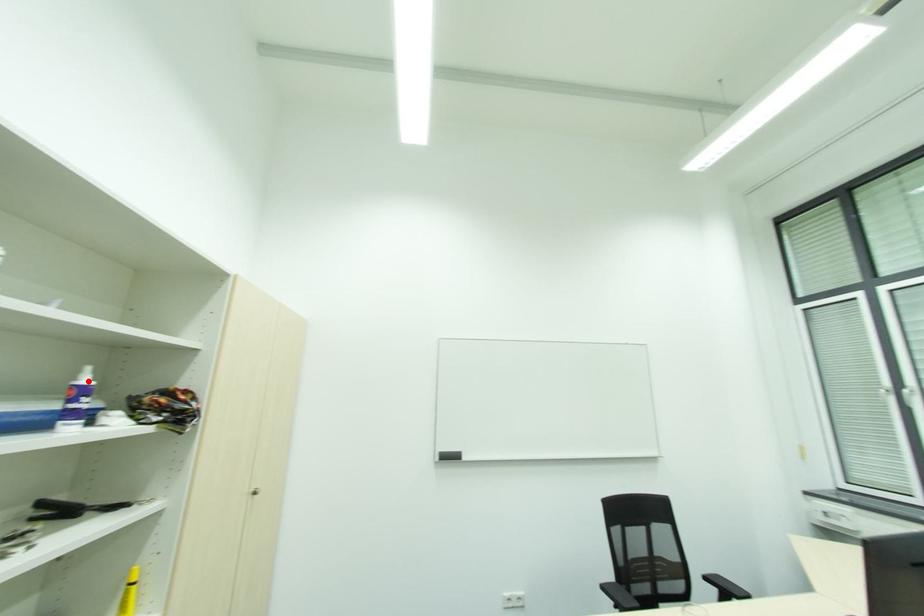
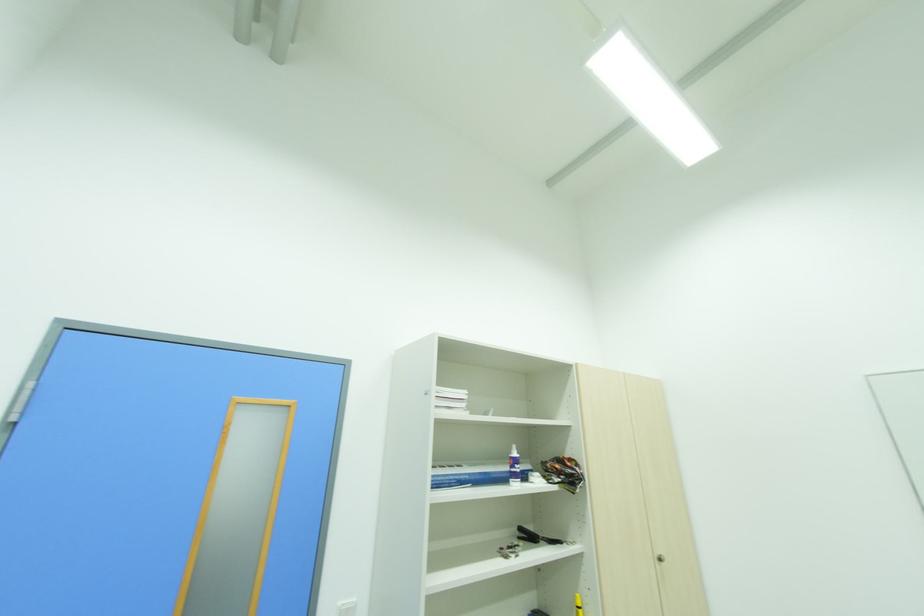
Locate, in the second image, the point that corresponds to the highlighted location in the first image.

(517, 455)